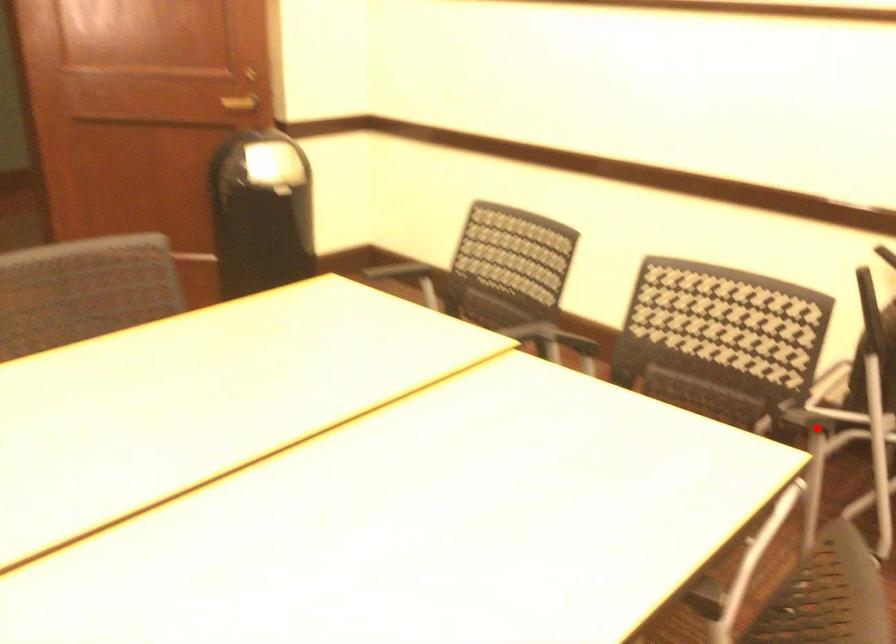
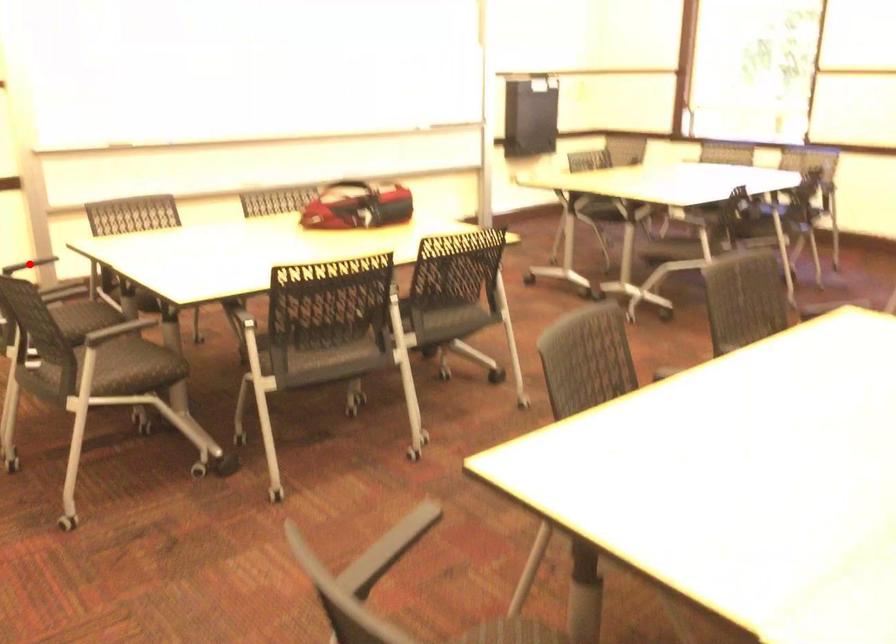
I am providing you with two images of the same scene from different viewpoints. A red point is marked on the first image and another point is marked on the second image. Is the red point in image1 aligned with the point shown in image2?

No